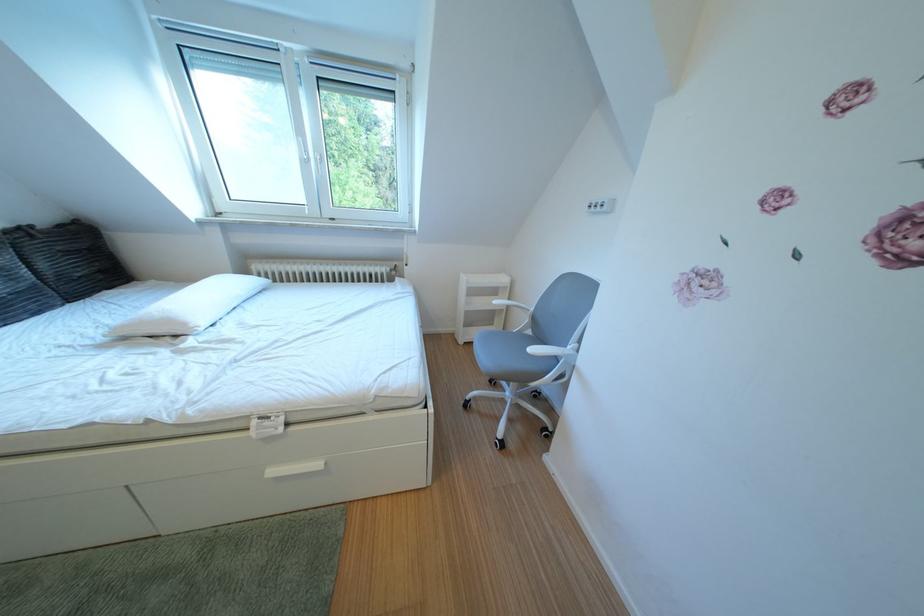
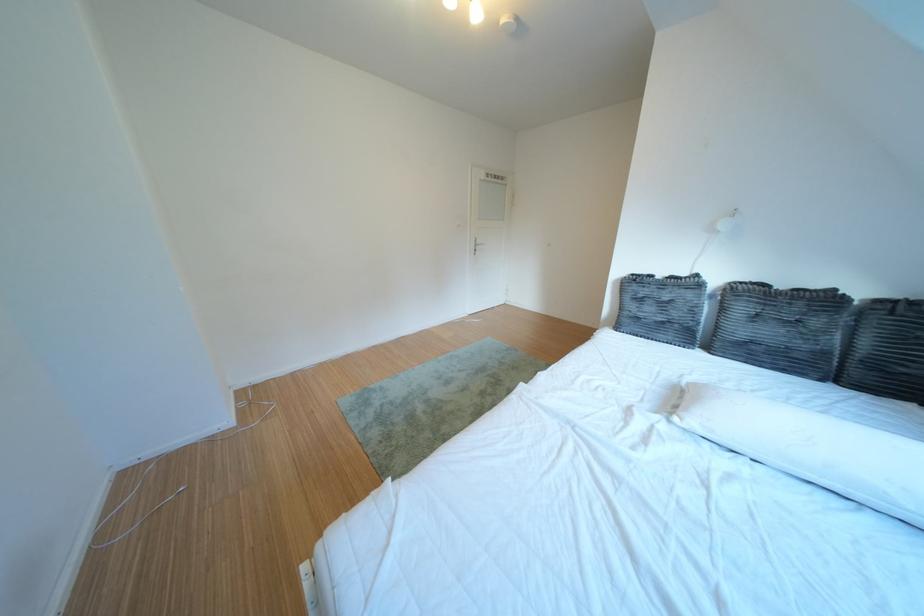
The point at (214, 326) is marked in the first image. Where is the corresponding point in the second image?

(707, 424)